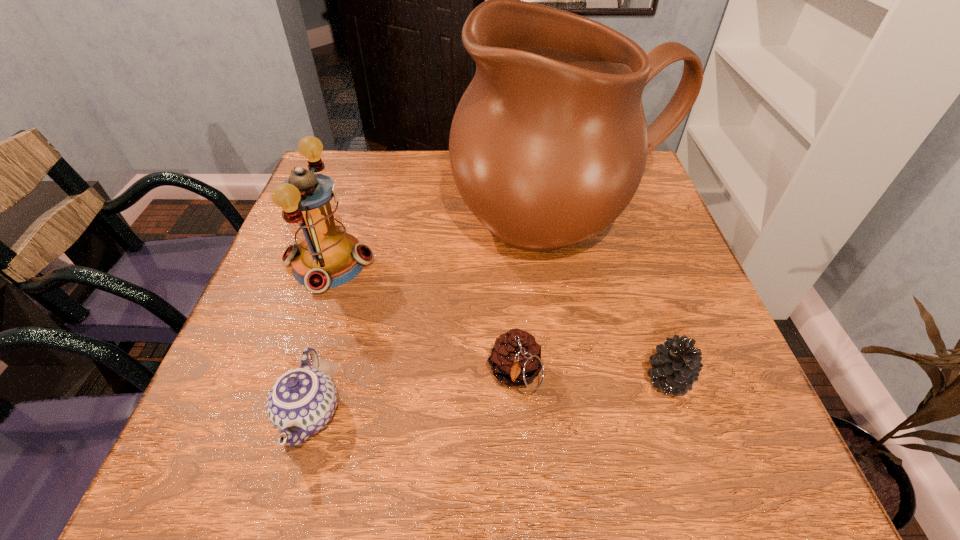
The height and width of the screenshot is (540, 960). In order to click on cream pitcher in this screenshot , I will do `click(548, 145)`.

At what (x,y) coordinates should I click in order to perform the action: click on lantern. Please return your answer as a coordinate pair (x, y). Looking at the image, I should click on (325, 256).

Where is `the right pinecone`? Image resolution: width=960 pixels, height=540 pixels. the right pinecone is located at coordinates (675, 367).

Locate an element on the screen. Image resolution: width=960 pixels, height=540 pixels. the left pinecone is located at coordinates (515, 360).

Where is `chinaware`? The image size is (960, 540). chinaware is located at coordinates (302, 401).

You are a GUI agent. You are given a task and a screenshot of the screen. Output one action in this format:
    pyautogui.click(x=<x>, y=<y>)
    Task: Click on the vacant space located at the spout of the cream pitcher
    The image size is (960, 540).
    Given the screenshot: What is the action you would take?
    pyautogui.click(x=591, y=372)

The height and width of the screenshot is (540, 960). Identify the location of free space located on the front-facing side of the second tallest object. (402, 263).

Find the location of a particular element. vacant region located 0.100m on the front of the right pinecone is located at coordinates (695, 461).

Where is `vacant space located with a leaf charm attached to the left pinecone`? Image resolution: width=960 pixels, height=540 pixels. vacant space located with a leaf charm attached to the left pinecone is located at coordinates (520, 458).

This screenshot has height=540, width=960. Find the location of `object at the far edge`. object at the far edge is located at coordinates [548, 145].